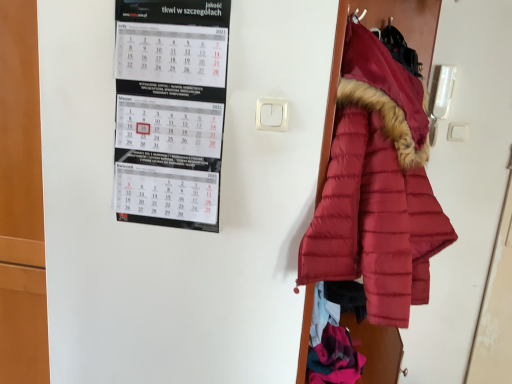
The width and height of the screenshot is (512, 384). What do you see at coordinates (377, 187) in the screenshot? I see `matte red puffer coat at right` at bounding box center [377, 187].

This screenshot has width=512, height=384. I want to click on matte red puffer coat at right, so click(377, 187).

From the picture: Measure the distance between matte red puffer coat at right and camera.

matte red puffer coat at right is 38.55 inches from camera.

What do you see at coordinates (170, 111) in the screenshot? I see `white paper calendar at upper left` at bounding box center [170, 111].

The height and width of the screenshot is (384, 512). I want to click on white paper calendar at upper left, so click(x=170, y=111).

At what (x,y) coordinates should I click in order to perform the action: click on matte red puffer coat at right. Please return your answer as a coordinate pair (x, y). This screenshot has width=512, height=384. Looking at the image, I should click on (377, 187).

Is matte red puffer coat at right at the left side of white paper calendar at upper left?

Incorrect, matte red puffer coat at right is not on the left side of white paper calendar at upper left.

Which object is further away from the camera, matte red puffer coat at right or white paper calendar at upper left?

white paper calendar at upper left.

Is point (398, 224) farther from viewer compared to point (209, 114)?

No, it is not.

From the image's perspective, is matte red puffer coat at right below white paper calendar at upper left?

Correct, matte red puffer coat at right appears lower than white paper calendar at upper left in the image.

From a real-world perspective, is matte red puffer coat at right below white paper calendar at upper left?

Yes, from a real-world perspective, matte red puffer coat at right is below white paper calendar at upper left.

Looking at their sizes, would you say matte red puffer coat at right is wider or thinner than white paper calendar at upper left?

In the image, matte red puffer coat at right appears to be wider than white paper calendar at upper left.

Does matte red puffer coat at right have a greater height compared to white paper calendar at upper left?

Yes.

Can you confirm if matte red puffer coat at right is smaller than white paper calendar at upper left?

No.

Is matte red puffer coat at right positioned beyond the bounds of white paper calendar at upper left?

matte red puffer coat at right is positioned outside white paper calendar at upper left.

Is matte red puffer coat at right not near white paper calendar at upper left?

No, matte red puffer coat at right is in close proximity to white paper calendar at upper left.

Could you tell me if matte red puffer coat at right is turned towards white paper calendar at upper left?

No, matte red puffer coat at right is not oriented towards white paper calendar at upper left.

Measure the distance from matte red puffer coat at right to white paper calendar at upper left.

matte red puffer coat at right is 42.12 centimeters away from white paper calendar at upper left.

At what (x,y) coordinates should I click in order to perform the action: click on bulletin board on the left of matte red puffer coat at right. Please return your answer as a coordinate pair (x, y). The height and width of the screenshot is (384, 512). Looking at the image, I should click on (170, 111).

Is white paper calendar at upper left to the left or to the right of matte red puffer coat at right in the image?

From the image, it's evident that white paper calendar at upper left is to the left of matte red puffer coat at right.

Is white paper calendar at upper left positioned behind matte red puffer coat at right?

Yes, it is.

Does point (222, 62) appear closer or farther from the camera than point (372, 162)?

Point (222, 62) is positioned farther from the camera compared to point (372, 162).

From the image's perspective, is white paper calendar at upper left beneath matte red puffer coat at right?

No, from the image's perspective, white paper calendar at upper left is not beneath matte red puffer coat at right.

From a real-world perspective, is white paper calendar at upper left on top of matte red puffer coat at right?

Correct, in the physical world, white paper calendar at upper left is higher than matte red puffer coat at right.

Can you confirm if white paper calendar at upper left is wider than matte red puffer coat at right?

Incorrect, the width of white paper calendar at upper left does not surpass that of matte red puffer coat at right.

Who is shorter, white paper calendar at upper left or matte red puffer coat at right?

Standing shorter between the two is white paper calendar at upper left.

Can you confirm if white paper calendar at upper left is bigger than matte red puffer coat at right?

No, white paper calendar at upper left is not bigger than matte red puffer coat at right.

In the scene shown: Is white paper calendar at upper left inside or outside of matte red puffer coat at right?

white paper calendar at upper left is spatially situated outside matte red puffer coat at right.

Would you consider white paper calendar at upper left to be distant from matte red puffer coat at right?

Actually, white paper calendar at upper left and matte red puffer coat at right are a little close together.

Could you tell me if white paper calendar at upper left is facing matte red puffer coat at right?

No, white paper calendar at upper left is not turned towards matte red puffer coat at right.

The height and width of the screenshot is (384, 512). Find the location of `bulletin board above the matte red puffer coat at right (from a real-world perspective)`. bulletin board above the matte red puffer coat at right (from a real-world perspective) is located at coordinates (170, 111).

The image size is (512, 384). In order to click on coat in front of the white paper calendar at upper left in this screenshot , I will do `click(377, 187)`.

Locate an element on the screen. coat on the right of white paper calendar at upper left is located at coordinates point(377,187).